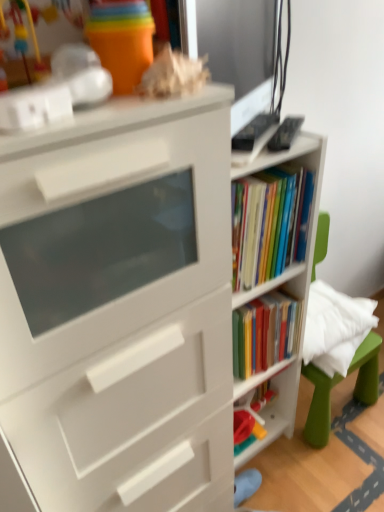
What is the approximate height of white matte bookcase at center?

white matte bookcase at center is 1.24 meters tall.

Where is `green plastic swivel chair at right`? Image resolution: width=384 pixels, height=512 pixels. green plastic swivel chair at right is located at coordinates (319, 406).

Is point (267, 435) positioned behind point (325, 152)?

That is True.

Could you tell me if plastic toy at center, arranged as the 1th shelf when ordered from the bottom, is turned towards white matte bookshelf at center, the 2th shelf ordered from the bottom?

Yes, plastic toy at center, arranged as the 1th shelf when ordered from the bottom, is aimed at white matte bookshelf at center, the 2th shelf ordered from the bottom.

Measure the distance from plastic toy at center, arranged as the 1th shelf when ordered from the bottom, to white matte bookshelf at center, the 2th shelf ordered from the bottom.

plastic toy at center, arranged as the 1th shelf when ordered from the bottom, and white matte bookshelf at center, the 2th shelf ordered from the bottom, are 3.64 inches apart from each other.

Is plastic toy at center, arranged as the 1th shelf when ordered from the bottom, inside the boundaries of white matte bookshelf at center, the 2th shelf ordered from the bottom, or outside?

plastic toy at center, arranged as the 1th shelf when ordered from the bottom, is contained in white matte bookshelf at center, the 2th shelf ordered from the bottom.

Which is more to the left, green plastic swivel chair at right or white matte bookshelf at center, marked as the 1th shelf in a top-to-bottom arrangement?

white matte bookshelf at center, marked as the 1th shelf in a top-to-bottom arrangement.

Considering the sizes of green plastic swivel chair at right and white matte bookshelf at center, the 2th shelf ordered from the bottom, in the image, is green plastic swivel chair at right wider or thinner than white matte bookshelf at center, the 2th shelf ordered from the bottom,?

Considering their sizes, green plastic swivel chair at right looks broader than white matte bookshelf at center, the 2th shelf ordered from the bottom.

Which point is more forward, (363, 361) or (291, 426)?

The point (291, 426) is in front.

Are green plastic swivel chair at right and white matte bookshelf at center, marked as the 1th shelf in a top-to-bottom arrangement, making contact?

No.

Considering the positions of objects green plastic swivel chair at right and plastic toy at center, arranged as the 1th shelf when ordered from the bottom, in the image provided, who is more to the left, green plastic swivel chair at right or plastic toy at center, arranged as the 1th shelf when ordered from the bottom,?

Positioned to the left is plastic toy at center, arranged as the 1th shelf when ordered from the bottom.

From the picture: Is green plastic swivel chair at right touching plastic toy at center, arranged as the 1th shelf when ordered from the bottom?

No, green plastic swivel chair at right is not with plastic toy at center, arranged as the 1th shelf when ordered from the bottom.

Is point (363, 392) farther from viewer compared to point (295, 385)?

Yes, it is behind point (295, 385).

From the image's perspective, is white matte bookcase at center on top of plastic toy at center, arranged as the 1th shelf when ordered from the bottom?

Yes, from the image's perspective, white matte bookcase at center is above plastic toy at center, arranged as the 1th shelf when ordered from the bottom.

Would you consider white matte bookcase at center to be distant from plastic toy at center, arranged as the 1th shelf when ordered from the bottom?

They are positioned close to each other.

Which object is further away from the camera taking this photo, white matte bookcase at center or plastic toy at center, which ranks as the 2th shelf in top-to-bottom order?

plastic toy at center, which ranks as the 2th shelf in top-to-bottom order, is more distant.

Looking at their sizes, would you say white matte bookcase at center is wider or thinner than plastic toy at center, which ranks as the 2th shelf in top-to-bottom order?

In the image, white matte bookcase at center appears to be wider than plastic toy at center, which ranks as the 2th shelf in top-to-bottom order.

In order to click on shelf that appears behind the white matte bookshelf at center, marked as the 1th shelf in a top-to-bottom arrangement in this screenshot , I will do [273, 404].

Which of these two, white matte bookshelf at center, marked as the 1th shelf in a top-to-bottom arrangement, or plastic toy at center, which ranks as the 2th shelf in top-to-bottom order, stands shorter?

plastic toy at center, which ranks as the 2th shelf in top-to-bottom order, is shorter.

In the scene shown: Can plastic toy at center, arranged as the 1th shelf when ordered from the bottom, be found inside white matte bookshelf at center, the 2th shelf ordered from the bottom?

Yes, white matte bookshelf at center, the 2th shelf ordered from the bottom, contains plastic toy at center, arranged as the 1th shelf when ordered from the bottom.

How distant is white matte bookshelf at center, marked as the 1th shelf in a top-to-bottom arrangement, from plastic toy at center, which ranks as the 2th shelf in top-to-bottom order?

They are 3.64 inches apart.

From a real-world perspective, which object stands above the other?

In real-world perspective, white matte bookcase at center is above.

Does white matte bookshelf at center, marked as the 1th shelf in a top-to-bottom arrangement, appear on the left side of white matte bookcase at center?

No, white matte bookshelf at center, marked as the 1th shelf in a top-to-bottom arrangement, is not to the left of white matte bookcase at center.

Is white matte bookshelf at center, the 2th shelf ordered from the bottom, facing towards white matte bookcase at center?

No, white matte bookshelf at center, the 2th shelf ordered from the bottom, is not facing towards white matte bookcase at center.

Can you confirm if white matte bookshelf at center, marked as the 1th shelf in a top-to-bottom arrangement, is wider than white matte bookcase at center?

Yes.

Which is more to the left, plastic toy at center, arranged as the 1th shelf when ordered from the bottom, or green plastic swivel chair at right?

From the viewer's perspective, plastic toy at center, arranged as the 1th shelf when ordered from the bottom, appears more on the left side.

Is point (255, 454) less distant than point (374, 340)?

That is True.

In the scene shown: Considering the sizes of objects plastic toy at center, arranged as the 1th shelf when ordered from the bottom, and green plastic swivel chair at right in the image provided, who is shorter, plastic toy at center, arranged as the 1th shelf when ordered from the bottom, or green plastic swivel chair at right?

Standing shorter between the two is plastic toy at center, arranged as the 1th shelf when ordered from the bottom.

The image size is (384, 512). I want to click on shelf that appears on the right of white matte bookshelf at center, marked as the 1th shelf in a top-to-bottom arrangement, so click(x=273, y=404).

The height and width of the screenshot is (512, 384). What are the coordinates of `shelf above the green plastic swivel chair at right (from the image's perspective)` in the screenshot? It's located at (289, 294).

Looking at this image, estimate the real-world distances between objects in this image. Which object is closer to plastic toy at center, which ranks as the 2th shelf in top-to-bottom order, green plastic swivel chair at right or matte black monitor at upper right?

green plastic swivel chair at right lies closer to plastic toy at center, which ranks as the 2th shelf in top-to-bottom order, than the other object.

When comparing their distances from white matte bookcase at center, does matte black monitor at upper right or green plastic swivel chair at right seem further?

Based on the image, green plastic swivel chair at right appears to be further to white matte bookcase at center.

Based on their spatial positions, is white matte bookshelf at center, the 2th shelf ordered from the bottom, or matte black monitor at upper right further from green plastic swivel chair at right?

Among the two, matte black monitor at upper right is located further to green plastic swivel chair at right.

Considering their positions, is white matte bookcase at center positioned closer to green plastic swivel chair at right than white matte bookshelf at center, the 2th shelf ordered from the bottom?

white matte bookshelf at center, the 2th shelf ordered from the bottom, is positioned closer to the anchor green plastic swivel chair at right.

Considering their positions, is white matte bookshelf at center, the 2th shelf ordered from the bottom, positioned closer to matte black monitor at upper right than plastic toy at center, arranged as the 1th shelf when ordered from the bottom?

white matte bookshelf at center, the 2th shelf ordered from the bottom, is positioned closer to the anchor matte black monitor at upper right.

Estimate the real-world distances between objects in this image. Which object is further from white matte bookshelf at center, the 2th shelf ordered from the bottom, plastic toy at center, which ranks as the 2th shelf in top-to-bottom order, or matte black monitor at upper right?

The object further to white matte bookshelf at center, the 2th shelf ordered from the bottom, is matte black monitor at upper right.

Which object lies further to the anchor point plastic toy at center, arranged as the 1th shelf when ordered from the bottom, white matte bookcase at center or green plastic swivel chair at right?

white matte bookcase at center lies further to plastic toy at center, arranged as the 1th shelf when ordered from the bottom, than the other object.

Which object lies further to the anchor point green plastic swivel chair at right, matte black monitor at upper right or white matte bookcase at center?

matte black monitor at upper right is further to green plastic swivel chair at right.

The image size is (384, 512). In order to click on swivel chair between white matte bookcase at center and plastic toy at center, which ranks as the 2th shelf in top-to-bottom order, from front to back in this screenshot , I will do pyautogui.click(x=319, y=406).

Find the location of a particular element. This screenshot has height=512, width=384. shelf between matte black monitor at upper right and white matte bookcase at center vertically is located at coordinates point(289,294).

Identify the location of shelf between matte black monitor at upper right and green plastic swivel chair at right vertically. (289, 294).

At what (x,y) coordinates should I click in order to perform the action: click on shelf between white matte bookcase at center and green plastic swivel chair at right from front to back. Please return your answer as a coordinate pair (x, y). This screenshot has height=512, width=384. Looking at the image, I should click on (289, 294).